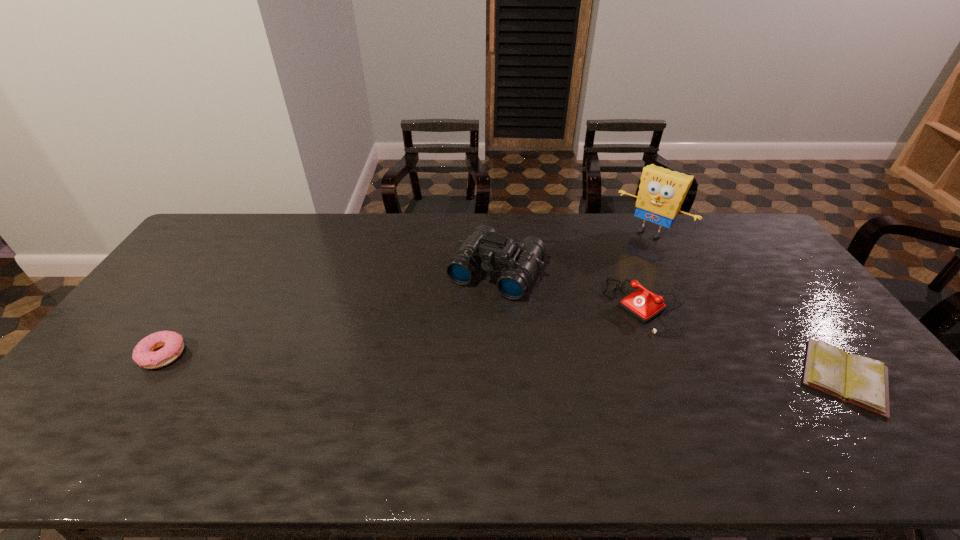
Locate an element on the screen. vacant space situated 0.390m on the dial of the telephone is located at coordinates (517, 393).

This screenshot has width=960, height=540. Identify the location of vacant area situated on the dial of the telephone. (606, 334).

Where is `free location located 0.300m on the dial of the telephone`? This screenshot has width=960, height=540. free location located 0.300m on the dial of the telephone is located at coordinates (544, 375).

Where is `vacant space located through the lenses of the binoculars`? This screenshot has width=960, height=540. vacant space located through the lenses of the binoculars is located at coordinates (448, 348).

At what (x,y) coordinates should I click in order to perform the action: click on blank space located 0.190m through the lenses of the binoculars. Please return your answer as a coordinate pair (x, y). Image resolution: width=960 pixels, height=540 pixels. Looking at the image, I should click on (450, 346).

Where is `free space located 0.270m through the lenses of the binoculars`? The width and height of the screenshot is (960, 540). free space located 0.270m through the lenses of the binoculars is located at coordinates (437, 367).

Locate an element on the screen. Image resolution: width=960 pixels, height=540 pixels. vacant space located 0.120m on the face of the sponge is located at coordinates (621, 262).

This screenshot has height=540, width=960. I want to click on vacant area situated 0.360m on the face of the sponge, so click(x=588, y=301).

Find the location of `vacant space situated on the face of the sponge`. vacant space situated on the face of the sponge is located at coordinates (622, 260).

The image size is (960, 540). In order to click on binoculars located in the far edge section of the desktop in this screenshot , I will do `click(484, 247)`.